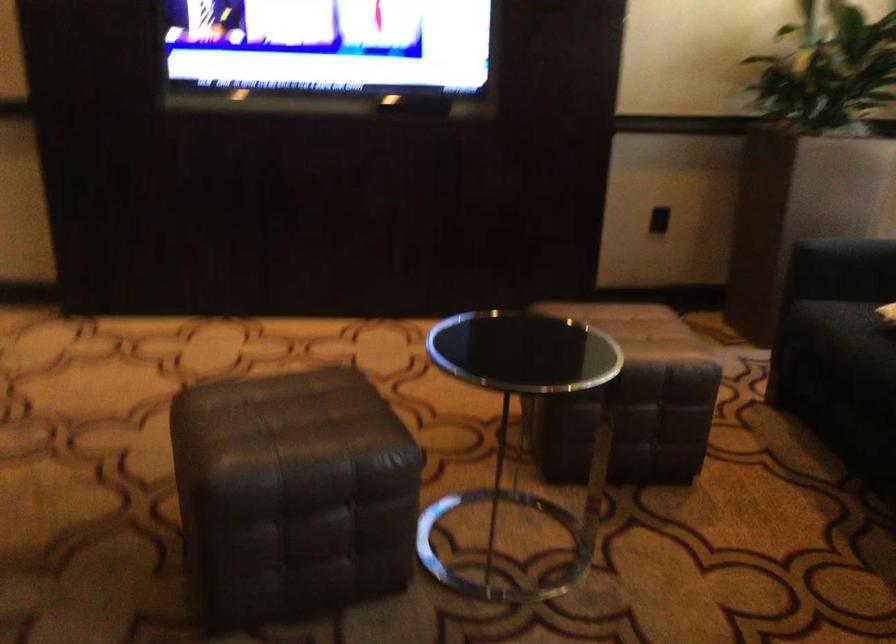
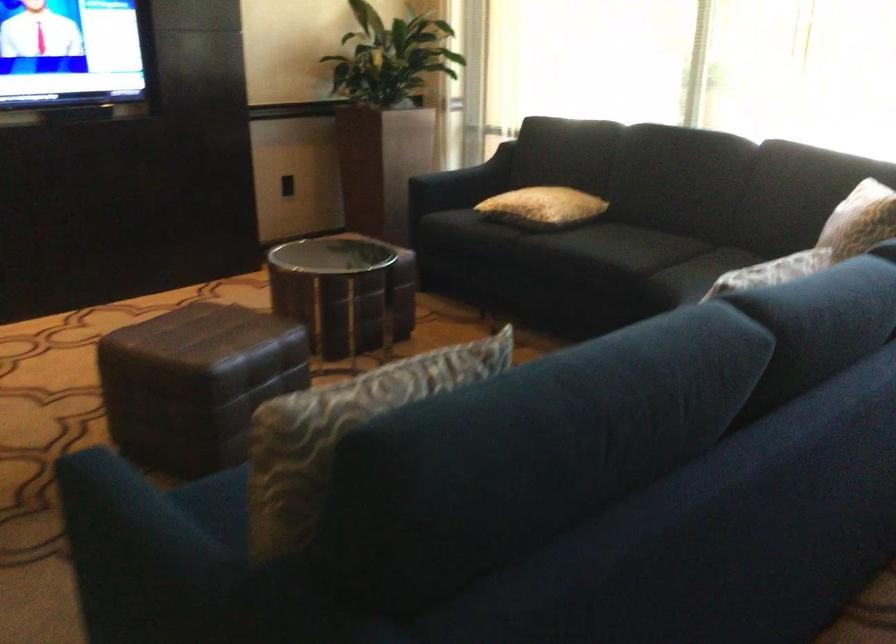
Where in the second image is the point corresponding to point (191, 491) from the first image?

(195, 383)